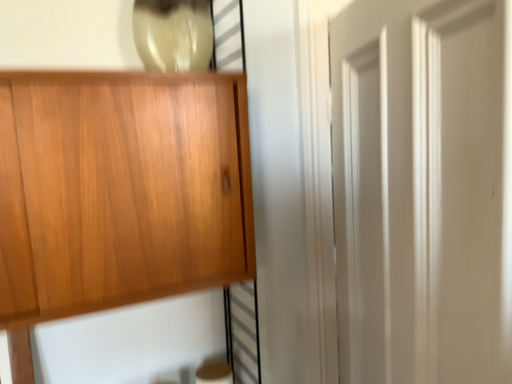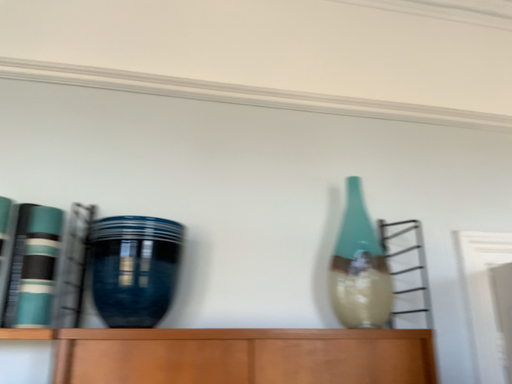
Question: How did the camera likely rotate when shooting the video?

Choices:
 (A) rotated left
 (B) rotated right

Answer: (A)